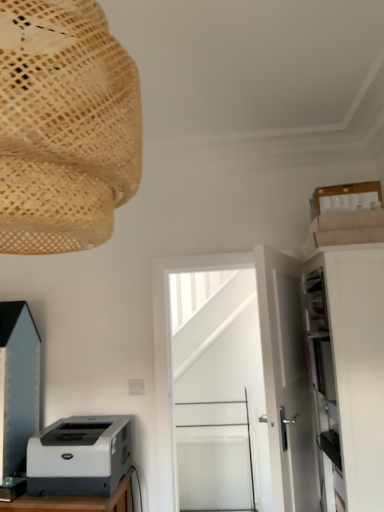
In order to face white matte door at center, marked as the first door in a front-to-back arrangement, should I rotate leftwards or rightwards?

A 12.805 degree turn to the right will do.

Image resolution: width=384 pixels, height=512 pixels. In order to click on white matte door at center, marked as the first door in a front-to-back arrangement in this screenshot , I will do `click(286, 382)`.

Identify the location of matte black cabinet at lower left, which ranks as the 2th cabinetry in right-to-left order. (18, 383).

Find the location of a particular element. This screenshot has width=384, height=512. natural woven lampshade at upper left is located at coordinates (64, 126).

This screenshot has height=512, width=384. In order to click on white plastic printer at lower left in this screenshot , I will do `click(79, 456)`.

In the scene shown: From a real-world perspective, is white matte door at center, which is the 1th door in back-to-front order, positioned under white plastic printer at lower left based on gravity?

No, from a real-world perspective, white matte door at center, which is the 1th door in back-to-front order, is not under white plastic printer at lower left.

Does white matte door at center, which is the second door from front to back, have a larger size compared to white plastic printer at lower left?

Correct, white matte door at center, which is the second door from front to back, is larger in size than white plastic printer at lower left.

Considering the relative positions of white matte door at center, which is the 1th door in back-to-front order, and white plastic printer at lower left in the image provided, is white matte door at center, which is the 1th door in back-to-front order, to the right of white plastic printer at lower left from the viewer's perspective?

Indeed, white matte door at center, which is the 1th door in back-to-front order, is positioned on the right side of white plastic printer at lower left.

Which object is positioned more to the right, white matte door at center, the 2th door in the back-to-front sequence, or white plastic printer at lower left?

white matte door at center, the 2th door in the back-to-front sequence, is more to the right.

From the image's perspective, which object appears higher, white matte door at center, marked as the first door in a front-to-back arrangement, or white plastic printer at lower left?

white matte door at center, marked as the first door in a front-to-back arrangement, is shown above in the image.

Between white matte door at center, marked as the first door in a front-to-back arrangement, and white plastic printer at lower left, which one has less height?

white plastic printer at lower left.

Considering the positions of objects white matte cabinet at right, which is the 2th cabinetry from left to right, and white plastic printer at lower left in the image provided, who is in front, white matte cabinet at right, which is the 2th cabinetry from left to right, or white plastic printer at lower left?

white matte cabinet at right, which is the 2th cabinetry from left to right, is more forward.

Is white matte cabinet at right, the first cabinetry positioned from the right, beside white plastic printer at lower left?

white matte cabinet at right, the first cabinetry positioned from the right, and white plastic printer at lower left are clearly separated.

Can you confirm if white matte cabinet at right, which is the 2th cabinetry from left to right, is positioned to the left of white plastic printer at lower left?

Incorrect, white matte cabinet at right, which is the 2th cabinetry from left to right, is not on the left side of white plastic printer at lower left.

Considering the sizes of objects white matte cabinet at right, the first cabinetry positioned from the right, and white plastic printer at lower left in the image provided, who is taller, white matte cabinet at right, the first cabinetry positioned from the right, or white plastic printer at lower left?

Standing taller between the two is white matte cabinet at right, the first cabinetry positioned from the right.

From a real-world perspective, which object rests below the other?

In real-world perspective, white matte cabinet at right, the first cabinetry positioned from the right, is lower.

Between white matte door at center, which is the second door from front to back, and white matte cabinet at right, which is the 2th cabinetry from left to right, which one is positioned in front?

white matte cabinet at right, which is the 2th cabinetry from left to right, is closer to the camera.

Consider the image. From the image's perspective, does white matte door at center, which is the 1th door in back-to-front order, appear lower than white matte cabinet at right, which is the 2th cabinetry from left to right?

Yes, from the image's perspective, white matte door at center, which is the 1th door in back-to-front order, is beneath white matte cabinet at right, which is the 2th cabinetry from left to right.

Considering the sizes of matte black cabinet at lower left, which ranks as the 2th cabinetry in right-to-left order, and white matte door at center, which is the 1th door in back-to-front order, in the image, is matte black cabinet at lower left, which ranks as the 2th cabinetry in right-to-left order, bigger or smaller than white matte door at center, which is the 1th door in back-to-front order,?

In the image, matte black cabinet at lower left, which ranks as the 2th cabinetry in right-to-left order, appears to be smaller than white matte door at center, which is the 1th door in back-to-front order.

Which is correct: matte black cabinet at lower left, the first cabinetry in the left-to-right sequence, is inside white matte door at center, which is the 1th door in back-to-front order, or outside of it?

matte black cabinet at lower left, the first cabinetry in the left-to-right sequence, lies outside white matte door at center, which is the 1th door in back-to-front order.

From a real-world perspective, does matte black cabinet at lower left, the first cabinetry in the left-to-right sequence, sit lower than white matte door at center, which is the second door from front to back?

No, from a real-world perspective, matte black cabinet at lower left, the first cabinetry in the left-to-right sequence, is not below white matte door at center, which is the second door from front to back.

Is the surface of white matte door at center, marked as the first door in a front-to-back arrangement, in direct contact with matte black cabinet at lower left, which ranks as the 2th cabinetry in right-to-left order?

No, white matte door at center, marked as the first door in a front-to-back arrangement, is not with matte black cabinet at lower left, which ranks as the 2th cabinetry in right-to-left order.

Is white matte door at center, marked as the first door in a front-to-back arrangement, shorter than matte black cabinet at lower left, the first cabinetry in the left-to-right sequence?

No, white matte door at center, marked as the first door in a front-to-back arrangement, is not shorter than matte black cabinet at lower left, the first cabinetry in the left-to-right sequence.

The width and height of the screenshot is (384, 512). Find the location of `cabinetry that is the 2nd object above the white matte door at center, the 2th door in the back-to-front sequence (from a real-world perspective)`. cabinetry that is the 2nd object above the white matte door at center, the 2th door in the back-to-front sequence (from a real-world perspective) is located at coordinates (18, 383).

From the picture: Is white matte cabinet at right, the first cabinetry positioned from the right, facing away from matte black cabinet at lower left, the first cabinetry in the left-to-right sequence?

No, white matte cabinet at right, the first cabinetry positioned from the right,'s orientation is not away from matte black cabinet at lower left, the first cabinetry in the left-to-right sequence.

Is white matte cabinet at right, the first cabinetry positioned from the right, not near matte black cabinet at lower left, which ranks as the 2th cabinetry in right-to-left order?

Yes, white matte cabinet at right, the first cabinetry positioned from the right, and matte black cabinet at lower left, which ranks as the 2th cabinetry in right-to-left order, are located far from each other.

Is white matte cabinet at right, which is the 2th cabinetry from left to right, positioned before matte black cabinet at lower left, which ranks as the 2th cabinetry in right-to-left order?

Yes, it is in front of matte black cabinet at lower left, which ranks as the 2th cabinetry in right-to-left order.

Find the location of a particular element. printer on the left of the white matte door at center, which is the 1th door in back-to-front order is located at coordinates (79, 456).

Locate an element on the screen. door in front of the white plastic printer at lower left is located at coordinates (286, 382).

Estimate the real-world distances between objects in this image. Which object is further from white matte cabinet at right, the first cabinetry positioned from the right, white matte door at center, marked as the first door in a front-to-back arrangement, or natural woven lampshade at upper left?

natural woven lampshade at upper left is further to white matte cabinet at right, the first cabinetry positioned from the right.

Considering their positions, is matte black cabinet at lower left, which ranks as the 2th cabinetry in right-to-left order, positioned further to natural woven lampshade at upper left than white matte door at center, which is the second door from front to back?

white matte door at center, which is the second door from front to back, is further to natural woven lampshade at upper left.

Considering their positions, is white plastic printer at lower left positioned further to white matte cabinet at right, which is the 2th cabinetry from left to right, than white matte door at center, marked as the first door in a front-to-back arrangement?

white plastic printer at lower left lies further to white matte cabinet at right, which is the 2th cabinetry from left to right, than the other object.

From the image, which object appears to be nearer to white matte door at center, the 2th door in the back-to-front sequence, white matte door at center, which is the second door from front to back, or white plastic printer at lower left?

white plastic printer at lower left is closer to white matte door at center, the 2th door in the back-to-front sequence.

Looking at the image, which one is located closer to white matte door at center, marked as the first door in a front-to-back arrangement, white matte door at center, which is the 1th door in back-to-front order, or matte black cabinet at lower left, the first cabinetry in the left-to-right sequence?

Based on the image, matte black cabinet at lower left, the first cabinetry in the left-to-right sequence, appears to be nearer to white matte door at center, marked as the first door in a front-to-back arrangement.

From the image, which object appears to be nearer to white matte door at center, marked as the first door in a front-to-back arrangement, natural woven lampshade at upper left or white plastic printer at lower left?

white plastic printer at lower left.

Based on their spatial positions, is white matte door at center, the 2th door in the back-to-front sequence, or white plastic printer at lower left closer to white matte cabinet at right, which is the 2th cabinetry from left to right?

Based on the image, white matte door at center, the 2th door in the back-to-front sequence, appears to be nearer to white matte cabinet at right, which is the 2th cabinetry from left to right.

Looking at the image, which one is located further to white matte cabinet at right, the first cabinetry positioned from the right, white plastic printer at lower left or natural woven lampshade at upper left?

The object further to white matte cabinet at right, the first cabinetry positioned from the right, is natural woven lampshade at upper left.

The width and height of the screenshot is (384, 512). What are the coordinates of `door between white plastic printer at lower left and white matte door at center, marked as the first door in a front-to-back arrangement, in the horizontal direction` in the screenshot? It's located at (233, 385).

I want to click on lamp between matte black cabinet at lower left, which ranks as the 2th cabinetry in right-to-left order, and white matte cabinet at right, which is the 2th cabinetry from left to right, in the horizontal direction, so click(64, 126).

Where is `door positioned between natural woven lampshade at upper left and white matte door at center, which is the 1th door in back-to-front order, from near to far`? Image resolution: width=384 pixels, height=512 pixels. door positioned between natural woven lampshade at upper left and white matte door at center, which is the 1th door in back-to-front order, from near to far is located at coordinates (286, 382).

Identify the location of lamp located between matte black cabinet at lower left, the first cabinetry in the left-to-right sequence, and white matte door at center, the 2th door in the back-to-front sequence, in the left-right direction. (64, 126).